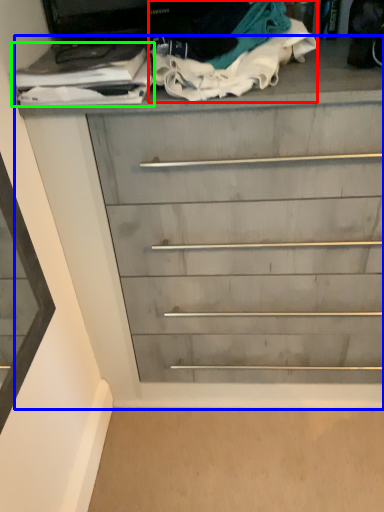
Question: Which object is the farthest from clothing (highlighted by a red box)? Choose among these: chest of drawers (highlighted by a blue box) or clothing (highlighted by a green box).

Choices:
 (A) chest of drawers
 (B) clothing

Answer: (A)